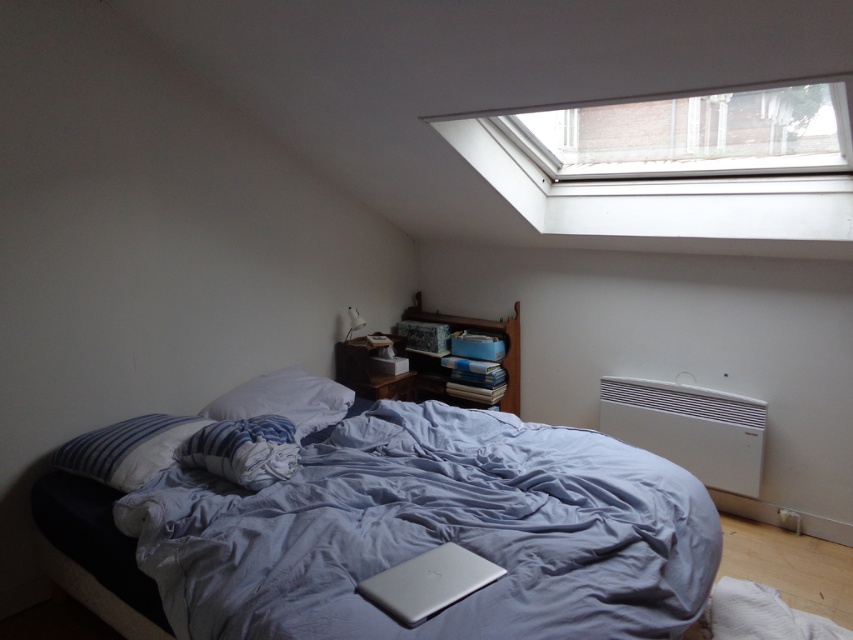
Does point (235, 576) come closer to viewer compared to point (412, 582)?

No.

Is blue cotton bedsheet at center positioned in front of silver metallic laptop at lower center?

Yes, it is in front of silver metallic laptop at lower center.

What do you see at coordinates (434, 532) in the screenshot? This screenshot has width=853, height=640. I see `blue cotton bedsheet at center` at bounding box center [434, 532].

Locate an element on the screen. blue cotton bedsheet at center is located at coordinates (434, 532).

Does transparent glass window at upper center appear on the right side of white plastic radiator at lower right?

Incorrect, transparent glass window at upper center is not on the right side of white plastic radiator at lower right.

Can you confirm if transparent glass window at upper center is thinner than white plastic radiator at lower right?

Incorrect, transparent glass window at upper center's width is not less than white plastic radiator at lower right's.

Between point (665, 230) and point (759, 445), which one is positioned in front?

Point (665, 230) is more forward.

In order to click on transparent glass window at upper center in this screenshot , I will do (x=675, y=163).

Consider the image. Measure the distance between white striped pillow at lower left and camera.

2.08 meters

Does point (125, 445) come farther from viewer compared to point (285, 369)?

No.

At what (x,y) coordinates should I click in order to perform the action: click on white striped pillow at lower left. Please return your answer as a coordinate pair (x, y). Looking at the image, I should click on (126, 449).